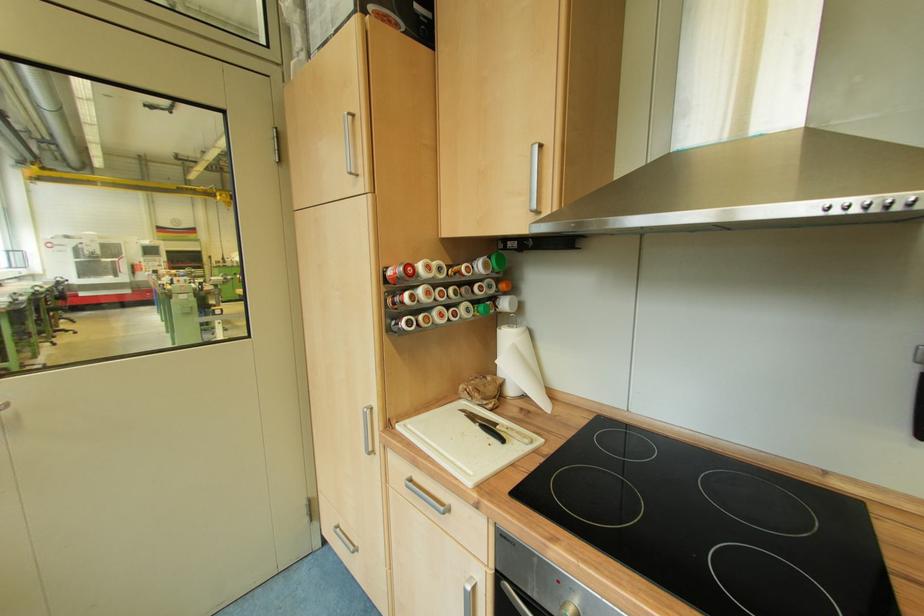
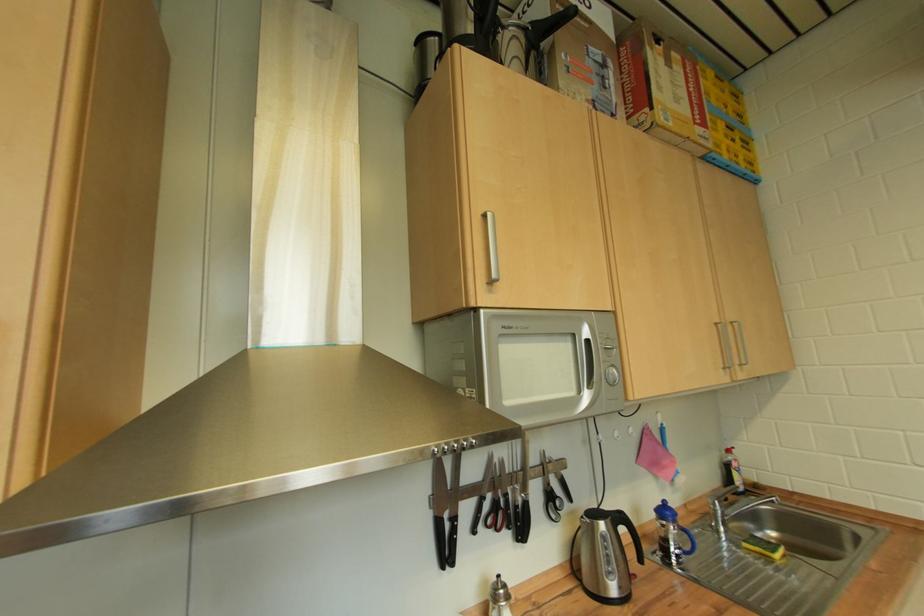
Question: Based on the continuous images, in which direction is the camera rotating? Reply with the corresponding letter.

Choices:
 (A) Left
 (B) Right
 (C) Up
 (D) Down

Answer: (B)